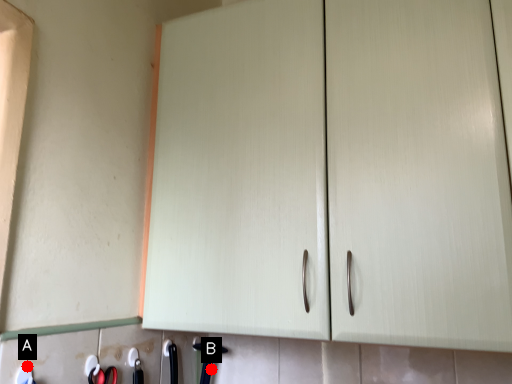
Question: Two points are circled on the image, labeled by A and B beside each circle. Which of the following is the closest to the observer?

Choices:
 (A) A is closer
 (B) B is closer

Answer: (A)